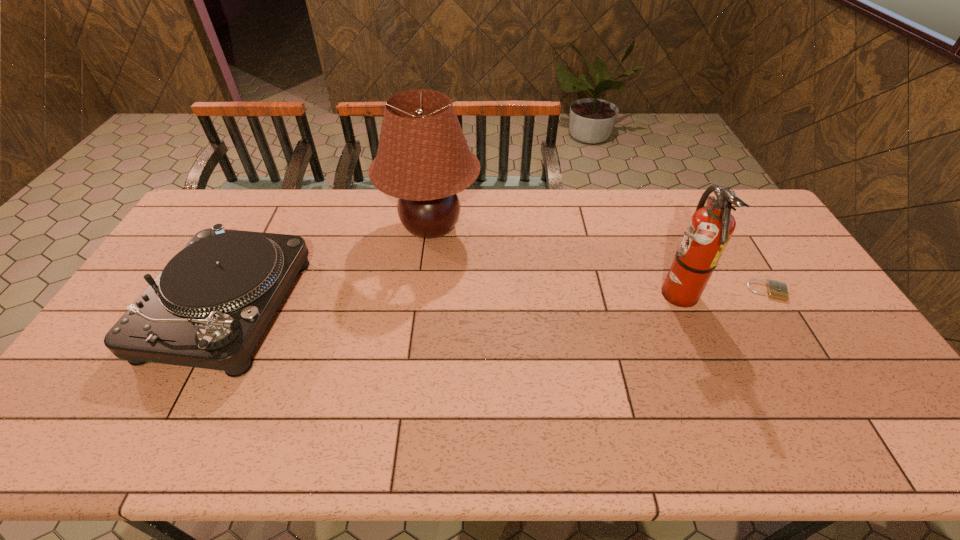
The height and width of the screenshot is (540, 960). I want to click on lampshade, so click(423, 159).

I want to click on the second object from right to left, so click(711, 227).

This screenshot has width=960, height=540. I want to click on the leftmost object, so click(x=208, y=308).

Where is `record player`? record player is located at coordinates (208, 308).

The height and width of the screenshot is (540, 960). I want to click on padlock, so click(x=778, y=290).

Where is `the rightmost object`? This screenshot has width=960, height=540. the rightmost object is located at coordinates (778, 290).

Identify the location of vacant space located 0.400m on the front-facing side of the lampshade. (596, 227).

This screenshot has width=960, height=540. I want to click on vacant space located from the nozzle of the third object from left to right, so click(556, 294).

The height and width of the screenshot is (540, 960). What are the coordinates of `vacant region located from the nozzle of the third object from left to right` in the screenshot? It's located at (626, 294).

The width and height of the screenshot is (960, 540). What are the coordinates of `vacant space located 0.220m from the nozzle of the third object from left to right` in the screenshot? It's located at (576, 294).